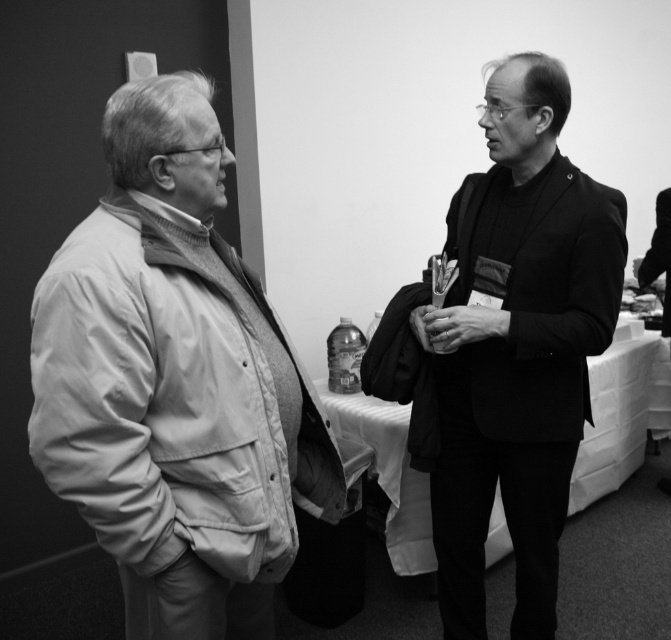
Question: Can you confirm if matte beige jacket at left is smaller than smooth black jacket at right?

Choices:
 (A) yes
 (B) no

Answer: (B)

Question: Which point is closer to the camera?

Choices:
 (A) (452, 346)
 (B) (652, 248)

Answer: (A)

Question: Which object is positioned farthest from the smooth black jacket at right?

Choices:
 (A) smooth black suit at center
 (B) matte beige jacket at left

Answer: (B)

Question: Estimate the real-world distances between objects in this image. Which object is closer to the smooth black jacket at right?

Choices:
 (A) smooth black suit at center
 (B) matte beige jacket at left

Answer: (A)

Question: Is matte beige jacket at left behind smooth black jacket at right?

Choices:
 (A) no
 (B) yes

Answer: (A)

Question: Does matte beige jacket at left appear on the right side of smooth black jacket at right?

Choices:
 (A) no
 (B) yes

Answer: (A)